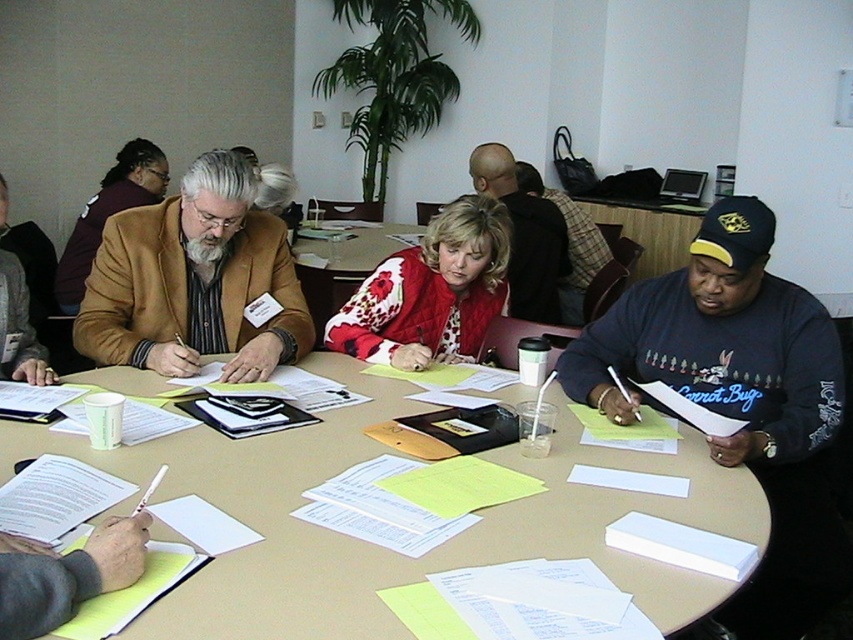
Question: Is matte brown jacket at center above brown leather jacket at upper left?

Choices:
 (A) yes
 (B) no

Answer: (B)

Question: Is light brown wooden table at center above dark blue sweatshirt at lower right?

Choices:
 (A) no
 (B) yes

Answer: (A)

Question: Which point appears closest to the camera in this image?

Choices:
 (A) (589, 346)
 (B) (511, 154)

Answer: (A)

Question: Which object is closer to the camera taking this photo?

Choices:
 (A) light brown wooden table at center
 (B) brown leather jacket at upper left
 (C) red floral sweater at center
 (D) floral-patterned fabric at center

Answer: (A)

Question: Estimate the real-world distances between objects in this image. Which object is closer to the matte brown jacket at center?

Choices:
 (A) light brown wooden table at center
 (B) dark blue sweatshirt at center

Answer: (A)

Question: Can you confirm if matte brown jacket at center is positioned to the right of red floral sweater at center?

Choices:
 (A) yes
 (B) no

Answer: (B)